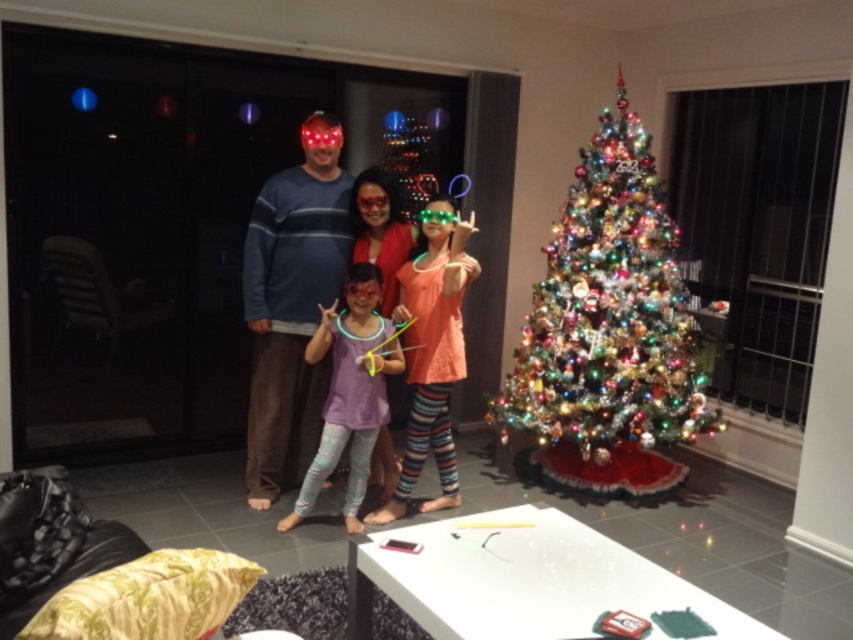
Is shiny metallic christmas tree at right thinner than purple matte leggings at center?

Incorrect, shiny metallic christmas tree at right's width is not less than purple matte leggings at center's.

Between shiny metallic christmas tree at right and purple matte leggings at center, which one is positioned lower?

purple matte leggings at center is below.

Which is in front, point (534, 432) or point (285, 524)?

Point (285, 524) is more forward.

The image size is (853, 640). Identify the location of shiny metallic christmas tree at right. pyautogui.click(x=608, y=314).

Does neon plastic glasses at center appear on the right side of purple matte leggings at center?

In fact, neon plastic glasses at center is to the left of purple matte leggings at center.

Can you confirm if neon plastic glasses at center is positioned above purple matte leggings at center?

Yes.

At what (x,y) coordinates should I click in order to perform the action: click on neon plastic glasses at center. Please return your answer as a coordinate pair (x, y). This screenshot has height=640, width=853. Looking at the image, I should click on (293, 304).

Is shiny metallic christmas tree at right to the right of neon plastic glasses at center from the viewer's perspective?

Indeed, shiny metallic christmas tree at right is positioned on the right side of neon plastic glasses at center.

Does shiny metallic christmas tree at right appear over neon plastic glasses at center?

Indeed, shiny metallic christmas tree at right is positioned over neon plastic glasses at center.

The image size is (853, 640). What do you see at coordinates (608, 314) in the screenshot?
I see `shiny metallic christmas tree at right` at bounding box center [608, 314].

Locate an element on the screen. shiny metallic christmas tree at right is located at coordinates (608, 314).